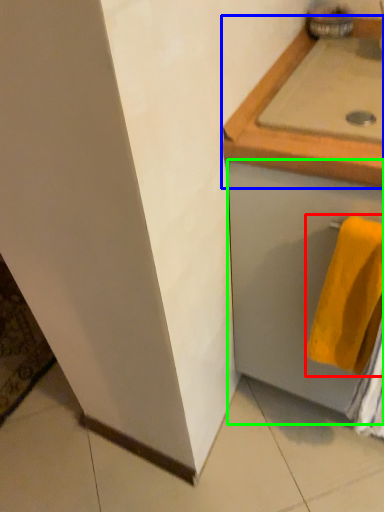
Question: Which object is the farthest from towel (highlighted by a red box)? Choose among these: countertop (highlighted by a blue box) or drawer (highlighted by a green box).

Choices:
 (A) countertop
 (B) drawer

Answer: (A)